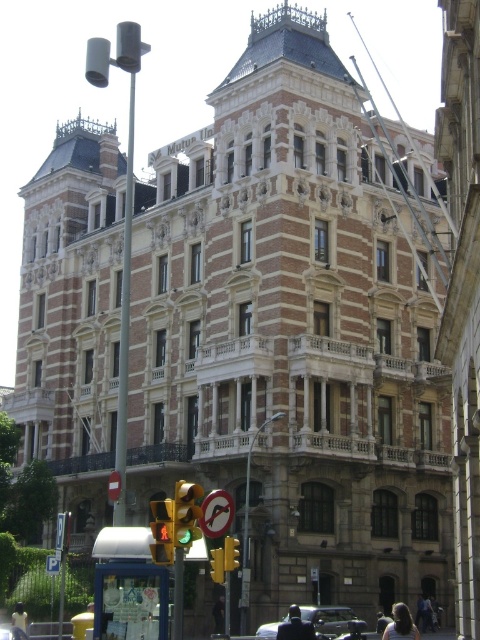
In the image of the grand building, there is a point labeled as point (19,621). Based on the scene description, where is this point located in relation to the light brown hair at lower left?

The point (19,621) is located on the light brown hair at lower left.

You are a delivery driver approaching the grand building. You see the yellow matte traffic light at lower left and a camera. How far apart are these two objects?

The yellow matte traffic light at lower left and the camera are 130.29 feet apart from each other.